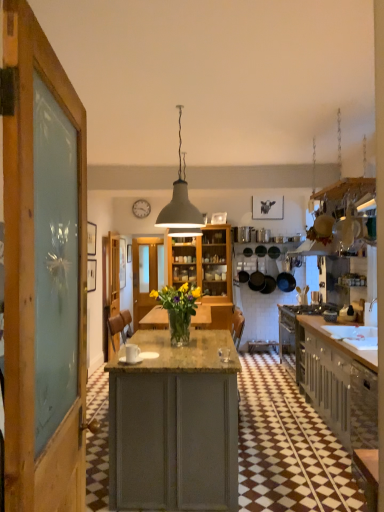
Question: Is translucent glass vase at center thinner than matte gray cabinets at right?

Choices:
 (A) no
 (B) yes

Answer: (B)

Question: Does translucent glass vase at center lie in front of matte gray cabinets at right?

Choices:
 (A) yes
 (B) no

Answer: (B)

Question: Can you confirm if translucent glass vase at center is wider than matte gray cabinets at right?

Choices:
 (A) yes
 (B) no

Answer: (B)

Question: From the image's perspective, is translucent glass vase at center beneath matte gray cabinets at right?

Choices:
 (A) no
 (B) yes

Answer: (A)

Question: From a real-world perspective, is translucent glass vase at center physically above matte gray cabinets at right?

Choices:
 (A) yes
 (B) no

Answer: (A)

Question: From the image's perspective, relative to white matte pendant light at center, is matte gray cabinets at right above or below?

Choices:
 (A) below
 (B) above

Answer: (A)

Question: Is matte gray cabinets at right to the left or to the right of white matte pendant light at center in the image?

Choices:
 (A) left
 (B) right

Answer: (B)

Question: In terms of width, does matte gray cabinets at right look wider or thinner when compared to white matte pendant light at center?

Choices:
 (A) wide
 (B) thin

Answer: (A)

Question: Is matte gray cabinets at right bigger or smaller than white matte pendant light at center?

Choices:
 (A) big
 (B) small

Answer: (A)

Question: Is point (177, 204) positioned closer to the camera than point (137, 308)?

Choices:
 (A) closer
 (B) farther

Answer: (A)

Question: In terms of size, does white matte pendant light at center appear bigger or smaller than transparent glass door at center?

Choices:
 (A) small
 (B) big

Answer: (A)

Question: Which is correct: white matte pendant light at center is inside transparent glass door at center, or outside of it?

Choices:
 (A) outside
 (B) inside

Answer: (A)

Question: Considering the positions of white matte pendant light at center and transparent glass door at center in the image, is white matte pendant light at center taller or shorter than transparent glass door at center?

Choices:
 (A) tall
 (B) short

Answer: (B)

Question: Looking at their shapes, would you say wooden door at center is wider or thinner than translucent glass vase at center?

Choices:
 (A) thin
 (B) wide

Answer: (A)

Question: Relative to translucent glass vase at center, is wooden door at center in front or behind?

Choices:
 (A) front
 (B) behind

Answer: (B)